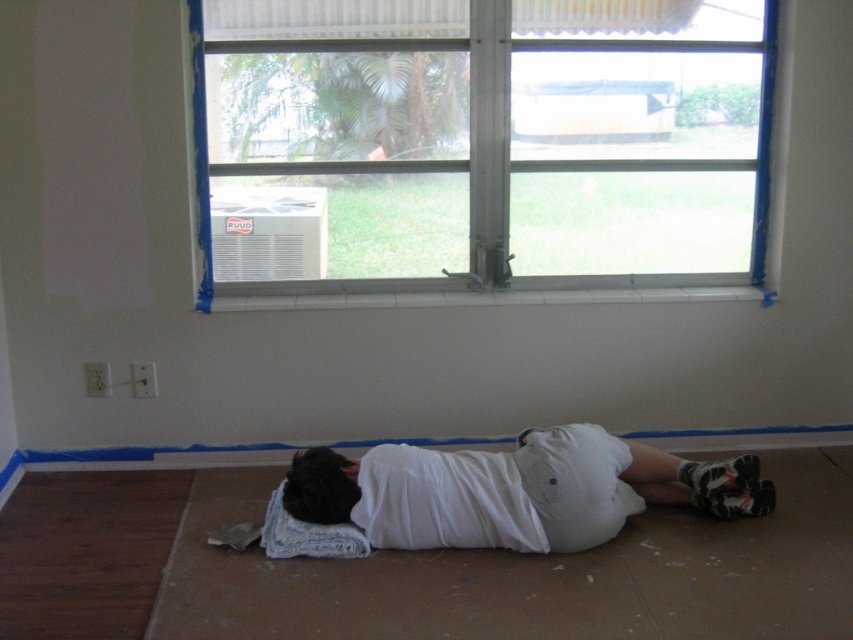
Can you confirm if clear glass window at center is bigger than black fuzzy head at center?

Correct, clear glass window at center is larger in size than black fuzzy head at center.

Which is behind, point (508, 26) or point (318, 497)?

Point (508, 26)

The image size is (853, 640). What are the coordinates of `clear glass window at center` in the screenshot? It's located at 479,144.

Is point (427, 531) less distant than point (357, 461)?

Yes, point (427, 531) is closer to viewer.

In the scene shown: Does white cotton shirt at lower center have a greater height compared to black fuzzy head at center?

Correct, white cotton shirt at lower center is much taller as black fuzzy head at center.

At what (x,y) coordinates should I click in order to perform the action: click on white cotton shirt at lower center. Please return your answer as a coordinate pair (x, y). Looking at the image, I should click on (514, 490).

This screenshot has width=853, height=640. Identify the location of white cotton shirt at lower center. (514, 490).

Which of these two, clear glass window at center or white cotton shirt at lower center, stands shorter?

white cotton shirt at lower center is shorter.

Can you confirm if clear glass window at center is bigger than white cotton shirt at lower center?

Yes, clear glass window at center is bigger than white cotton shirt at lower center.

Which is in front, point (683, 248) or point (601, 449)?

Point (601, 449) is in front.

You are a GUI agent. You are given a task and a screenshot of the screen. Output one action in this format:
    pyautogui.click(x=<x>, y=<y>)
    Task: Click on the clear glass window at center
    Image resolution: width=853 pixels, height=640 pixels.
    Given the screenshot: What is the action you would take?
    pos(479,144)